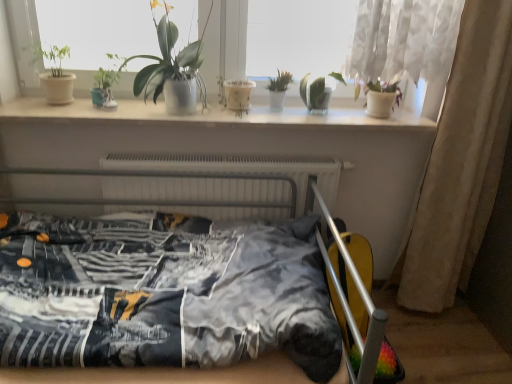
Question: Is white sheer curtain at right located within green glossy plant at upper center, the third houseplant from the right?

Choices:
 (A) yes
 (B) no

Answer: (B)

Question: Does green glossy plant at upper center, the third houseplant from the right, have a lesser height compared to white sheer curtain at right?

Choices:
 (A) no
 (B) yes

Answer: (B)

Question: Can you confirm if green glossy plant at upper center, the 3th houseplant from the left, is smaller than white sheer curtain at right?

Choices:
 (A) yes
 (B) no

Answer: (A)

Question: Considering the relative sizes of green glossy plant at upper center, the third houseplant from the right, and white sheer curtain at right in the image provided, is green glossy plant at upper center, the third houseplant from the right, wider than white sheer curtain at right?

Choices:
 (A) yes
 (B) no

Answer: (A)

Question: Is green glossy plant at upper center, the 3th houseplant from the left, turned away from white sheer curtain at right?

Choices:
 (A) yes
 (B) no

Answer: (B)

Question: Is green glossy plant at upper center, the 3th houseplant from the left, in front of or behind white glossy window sill at upper center in the image?

Choices:
 (A) front
 (B) behind

Answer: (A)

Question: Considering the positions of point (189, 56) and point (128, 104), is point (189, 56) closer or farther from the camera than point (128, 104)?

Choices:
 (A) farther
 (B) closer

Answer: (B)

Question: Visually, is green glossy plant at upper center, the third houseplant from the right, positioned to the left or to the right of white glossy window sill at upper center?

Choices:
 (A) right
 (B) left

Answer: (B)

Question: Based on their sizes in the image, would you say green glossy plant at upper center, the 3th houseplant from the left, is bigger or smaller than white glossy window sill at upper center?

Choices:
 (A) big
 (B) small

Answer: (A)

Question: From a real-world perspective, relative to white metallic radiator at center, is pink matte orchid at upper right vertically above or below?

Choices:
 (A) above
 (B) below

Answer: (A)

Question: In terms of size, does pink matte orchid at upper right appear bigger or smaller than white metallic radiator at center?

Choices:
 (A) small
 (B) big

Answer: (A)

Question: Is point (378, 109) closer or farther from the camera than point (125, 183)?

Choices:
 (A) farther
 (B) closer

Answer: (A)

Question: Relative to white metallic radiator at center, is pink matte orchid at upper right in front or behind?

Choices:
 (A) behind
 (B) front

Answer: (A)

Question: From their relative heights in the image, would you say white sheer curtain at right is taller or shorter than white metallic radiator at center?

Choices:
 (A) short
 (B) tall

Answer: (B)

Question: From a real-world perspective, is white sheer curtain at right above or below white metallic radiator at center?

Choices:
 (A) below
 (B) above

Answer: (B)